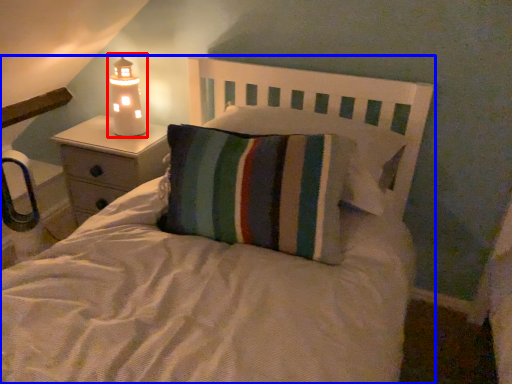
Question: Which of the following is the closest to the observer, lamp (highlighted by a red box) or bed (highlighted by a blue box)?

Choices:
 (A) lamp
 (B) bed

Answer: (B)